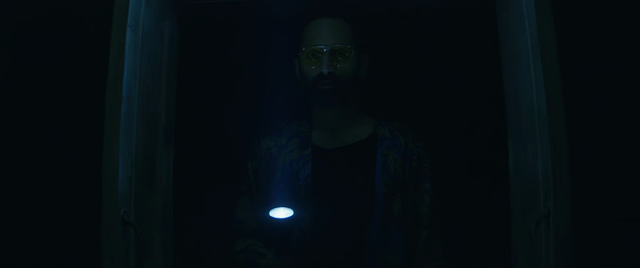
Locate an element on the screen. hall is located at coordinates (434, 101), (397, 92).